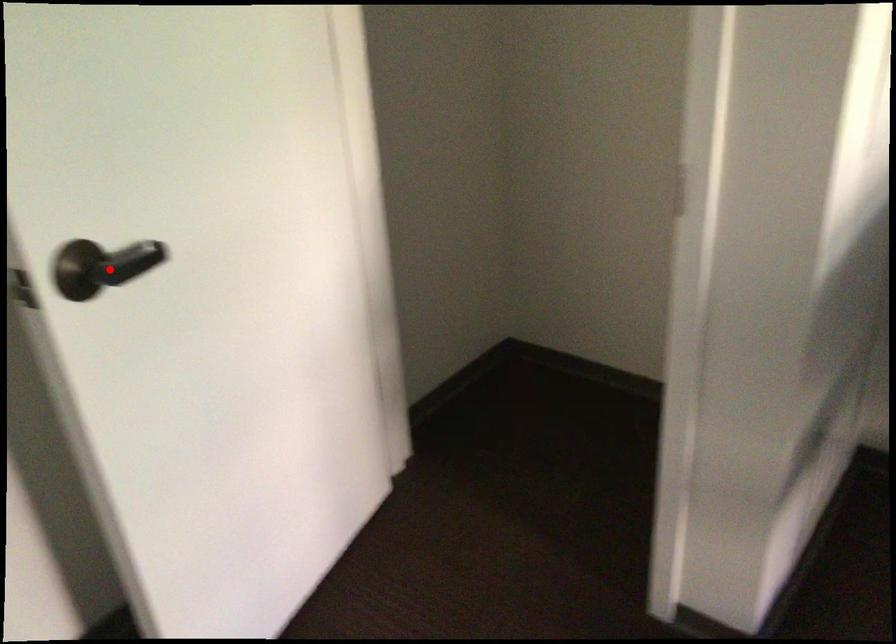
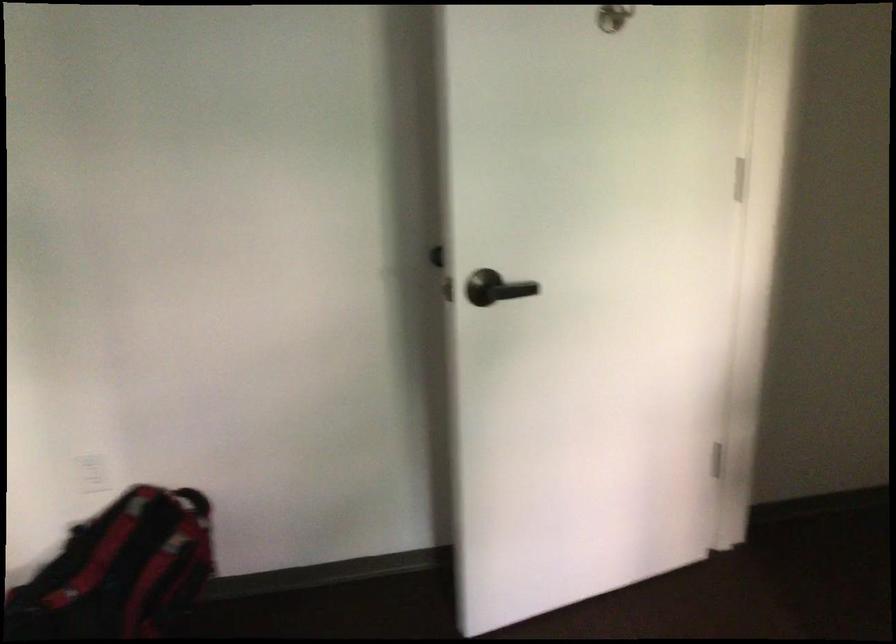
Question: I am providing you with two images of the same scene from different viewpoints. Image1 has a red point marked. In image2, the corresponding 3D location appears at what relative position? Reply with the corresponding letter.

Choices:
 (A) Closer
 (B) Farther

Answer: (B)